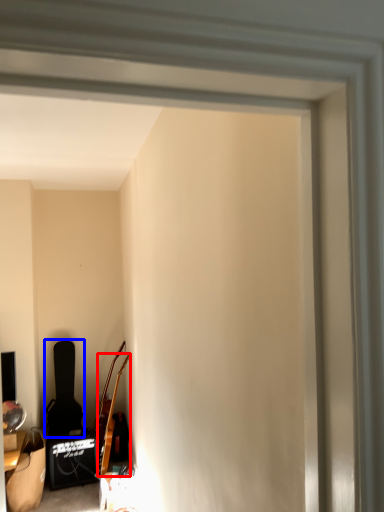
Question: Which point is further to the camera, guitar (highlighted by a red box) or chair (highlighted by a blue box)?

Choices:
 (A) guitar
 (B) chair

Answer: (B)